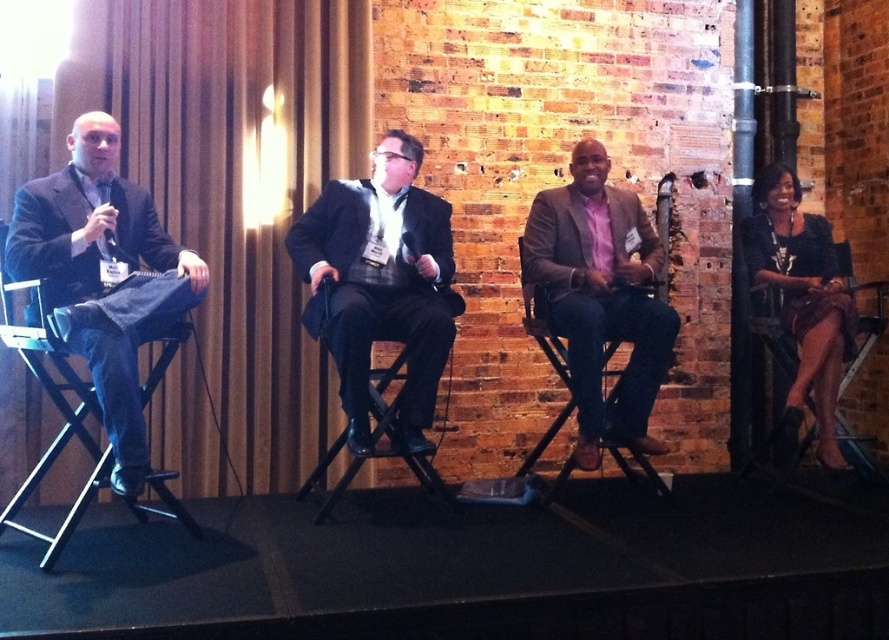
Question: Is black leather chair at right above black leather chair at center?

Choices:
 (A) yes
 (B) no

Answer: (A)

Question: Is the position of matte black suit at center more distant than that of black leather chair at right?

Choices:
 (A) yes
 (B) no

Answer: (B)

Question: Can you confirm if matte black suit at left is wider than black leather chair at right?

Choices:
 (A) yes
 (B) no

Answer: (B)

Question: Which point appears farthest from the camera in this image?

Choices:
 (A) (549, 192)
 (B) (334, 499)

Answer: (A)

Question: Considering the real-world distances, which object is farthest from the matte black suit at center?

Choices:
 (A) black leather chair at right
 (B) matte black suit at left
 (C) pink matte shirt at center

Answer: (A)

Question: Estimate the real-world distances between objects in this image. Which object is closer to the pink matte shirt at center?

Choices:
 (A) matte black suit at center
 (B) black leather chair at right

Answer: (A)